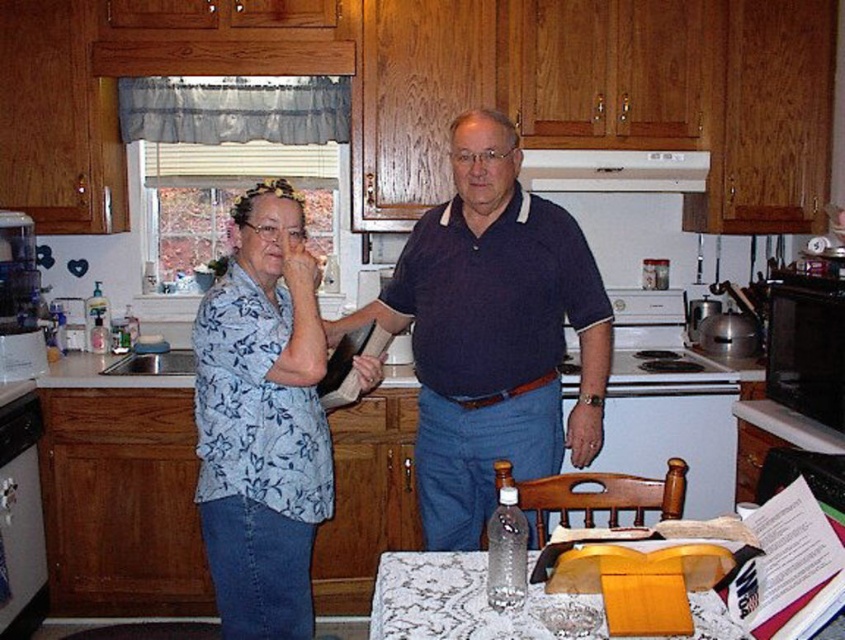
Does white glossy dishwasher at lower left lie in front of white glossy exhaust hood at upper center?

Yes.

Can you confirm if white glossy dishwasher at lower left is wider than white glossy exhaust hood at upper center?

No.

Measure the distance between point (3, 460) and camera.

Point (3, 460) and camera are 8.48 feet apart from each other.

At what (x,y) coordinates should I click in order to perform the action: click on white glossy dishwasher at lower left. Please return your answer as a coordinate pair (x, y). This screenshot has width=845, height=640. Looking at the image, I should click on (20, 516).

Is white glossy exhaust hood at upper center above clear plastic bottle at left?

Yes.

Can you confirm if white glossy exhaust hood at upper center is wider than clear plastic bottle at left?

Yes.

This screenshot has height=640, width=845. I want to click on white glossy exhaust hood at upper center, so click(x=614, y=170).

Locate an element on the screen. Image resolution: width=845 pixels, height=640 pixels. white glossy exhaust hood at upper center is located at coordinates (614, 170).

Is blue floral shirt at center to the left of white glossy dishwasher at lower left from the viewer's perspective?

No, blue floral shirt at center is not to the left of white glossy dishwasher at lower left.

Measure the distance between point (238,228) and camera.

They are 1.98 meters apart.

In order to click on blue floral shirt at center in this screenshot , I will do `click(262, 419)`.